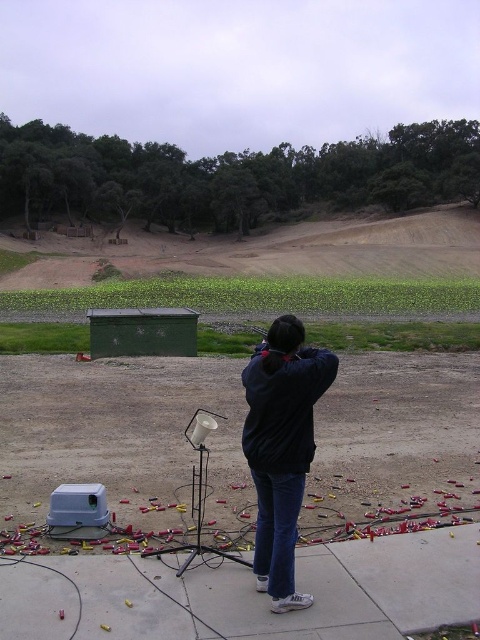
You are a photographer setting up a shot at the shooting range. You want to capture the dark blue jacket at center and the brown dirt field at upper center in the same frame. Which object should you focus on first to ensure both are in focus?

The brown dirt field at upper center is positioned over the dark blue jacket at center, so focusing on the brown dirt field at upper center first will ensure both are in focus because it is farther away and covers the jacket in the background.

You are a photographer trying to capture a wide shot of the brown dirt field at upper center and the dark blue jacket at center. Given that the field is wider than the jacket, which object should you focus on to ensure both are fully visible in the frame?

Answer: The brown dirt field at upper center is wider than the dark blue jacket at center, so focusing on the brown dirt field at upper center would ensure both are fully visible in the frame.